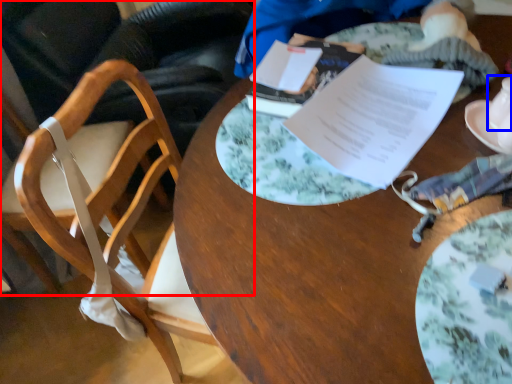
Question: Which object appears closest to the camera in this image, chair (highlighted by a red box) or tableware (highlighted by a blue box)?

Choices:
 (A) chair
 (B) tableware

Answer: (B)